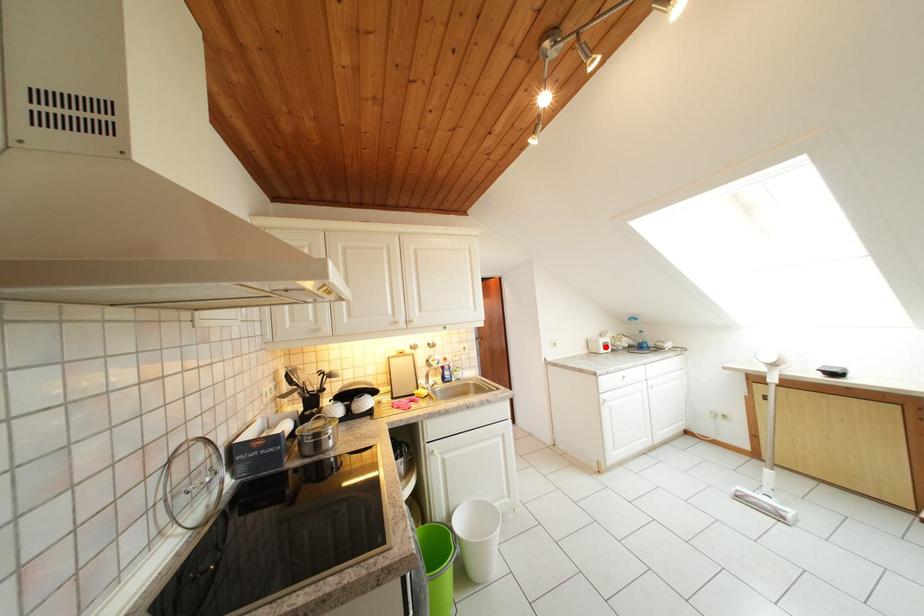
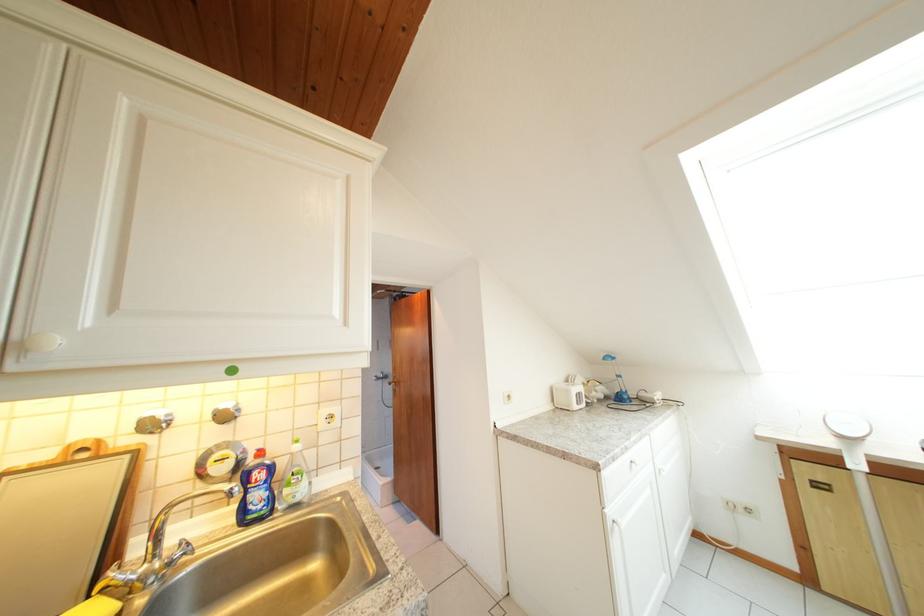
Question: I am providing you with two images of the same scene from different viewpoints. Given a red point in image1, look at the same physical point in image2. Is it:

Choices:
 (A) Closer to the viewpoint
 (B) Farther from the viewpoint

Answer: (B)